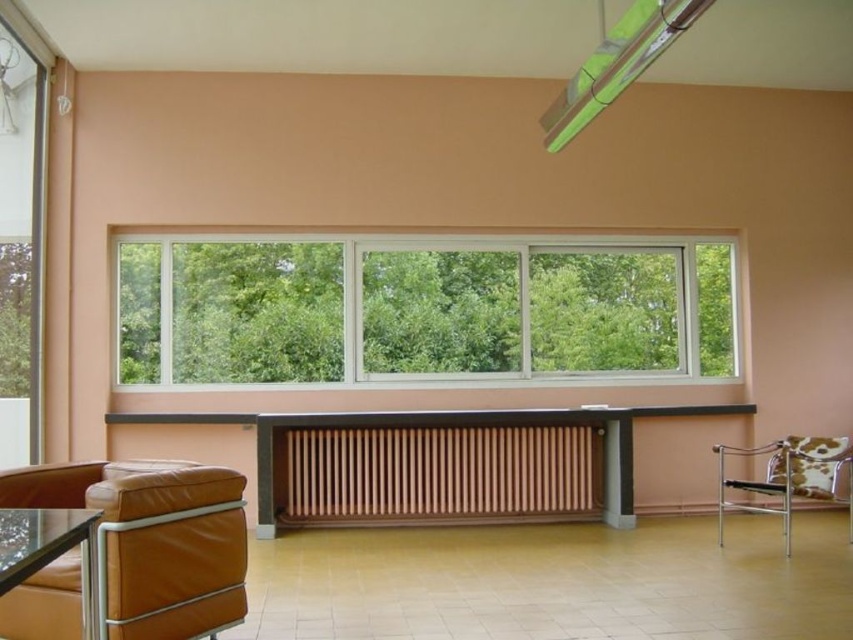
You are a visitor in this room and want to sit down. You see the cow print fabric chair at right and the transparent glass table at lower left. Which object is taller and would allow you to sit comfortably?

The cow print fabric chair at right is taller than the transparent glass table at lower left, so it would be the appropriate object to sit on comfortably.

You are planning to place a large potted plant in the living room. The plant requires a spot near a window for sunlight. Considering the clear glass window at center and the transparent glass table at lower left, which object should you place the plant near?

You should place the plant near the clear glass window at center because it has a larger size compared to the transparent glass table at lower left, providing more sunlight exposure.

You are standing in the living room and want to sit down. You see the brown leather couch at lower left and the wooden slats radiator at center. Which object is positioned higher up in the image?

The brown leather couch at lower left is located above the wooden slats radiator at center, so it is positioned higher up in the image.